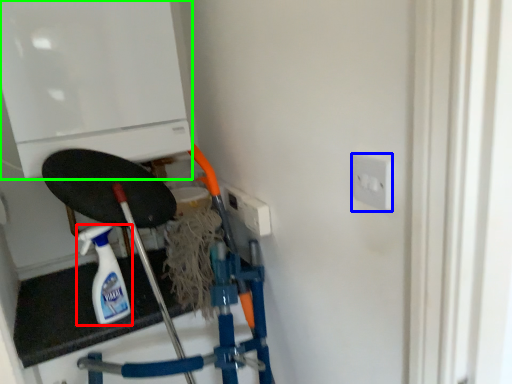
Question: Which object is positioned farthest from bottle (highlighted by a red box)? Select from socket (highlighted by a blue box) and appliance (highlighted by a green box).

Choices:
 (A) socket
 (B) appliance

Answer: (A)